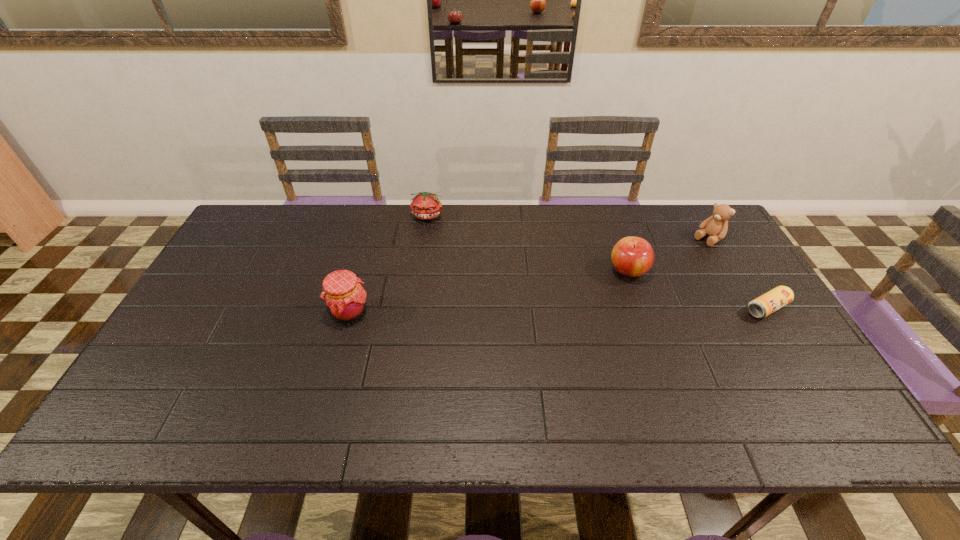
Find the location of a particular element. The image size is (960, 540). object that ranks as the fourth closest to the farthest object is located at coordinates (766, 304).

Identify which object is located as the fourth nearest to the apple. Please provide its 2D coordinates. Your answer should be formatted as a tuple, i.e. [(x, y)], where the tuple contains the x and y coordinates of a point satisfying the conditions above.

[(345, 299)]